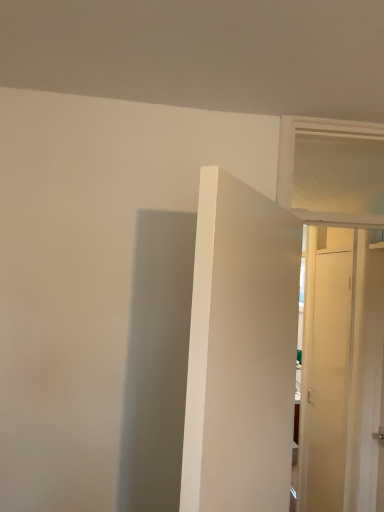
What do you see at coordinates (240, 350) in the screenshot?
I see `white matte door at center` at bounding box center [240, 350].

This screenshot has width=384, height=512. Find the location of `white matte door at center`. white matte door at center is located at coordinates (240, 350).

In order to face white matte door at center, should I rotate leftwards or rightwards?

To face it directly, rotate right by 9.031 degrees.

This screenshot has height=512, width=384. Identify the location of white matte door at center. (240, 350).